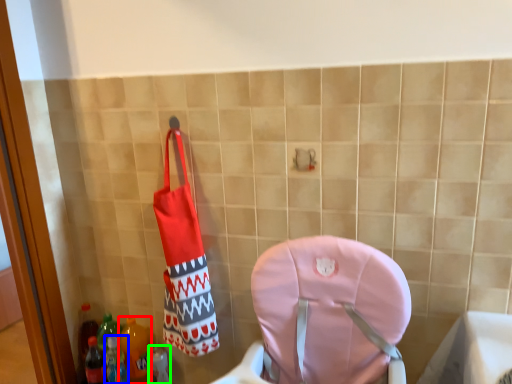
Question: Estimate the real-world distances between objects in this image. Which object is farther from bottle (highlighted by a red box), bottle (highlighted by a blue box) or bottle (highlighted by a green box)?

Choices:
 (A) bottle
 (B) bottle

Answer: (B)